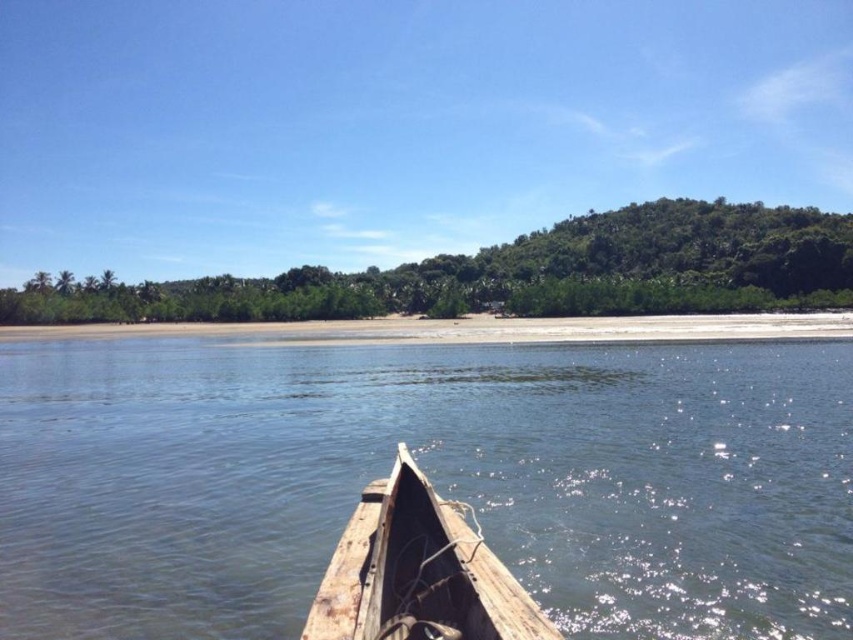
You are an explorer standing on the sandy beach at lower center and want to board the weathered wood boat at lower center. Can you reach the boat from your current position without walking far?

The weathered wood boat at lower center is shorter than sandy beach at lower center, so yes, you can reach the boat from the sandy beach at lower center without walking far since the boat is closer to the beach.

You are an observer sitting in the wooden boat at lower center and want to see the weathered wood boat at lower center. Which direction should you look to see it?

The weathered wood boat at lower center is behind the wooden boat at lower center, so you should look behind you to see it.

You are sitting in the wooden boat at lower center and want to step onto the sandy beach at lower center. Is the boat positioned in a way that allows you to easily step onto the beach?

The wooden boat at lower center is in front of the sandy beach at lower center, so stepping onto the beach would require moving backward or around the boat since it is positioned in front of the beach.